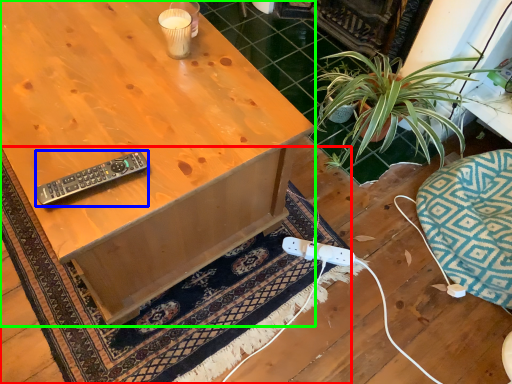
Question: Based on their relative distances, which object is farther from doormat (highlighted by a red box)? Choose from remote control (highlighted by a blue box) and desk (highlighted by a green box).

Choices:
 (A) remote control
 (B) desk

Answer: (A)